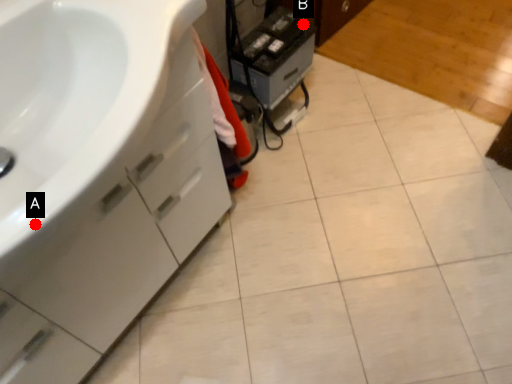
Question: Two points are circled on the image, labeled by A and B beside each circle. Among these points, which one is farthest from the camera?

Choices:
 (A) A is further
 (B) B is further

Answer: (B)